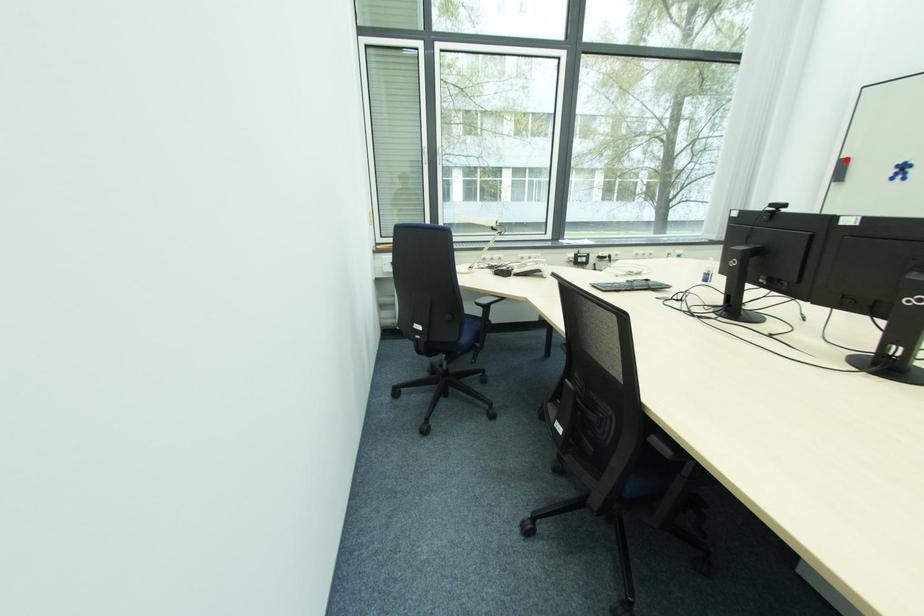
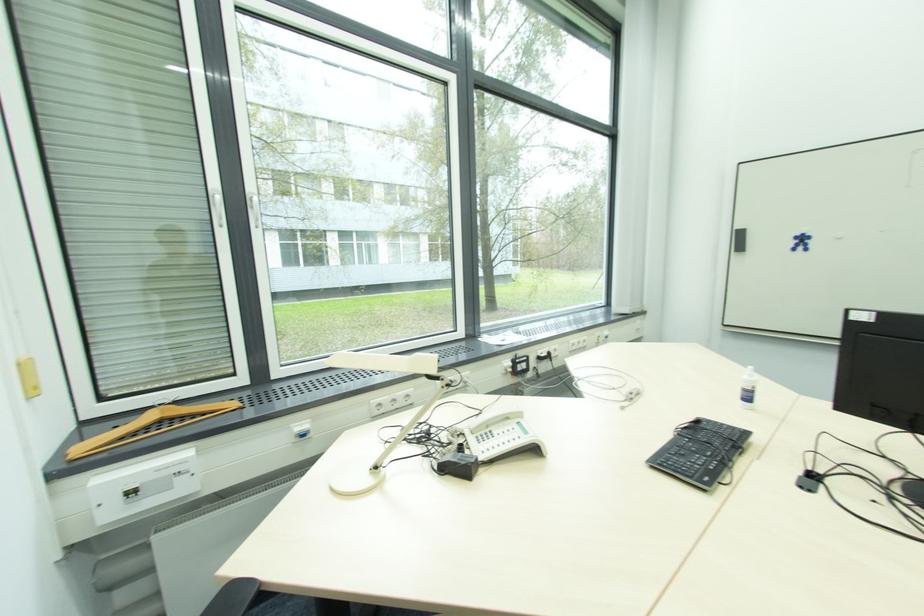
In the second image, find the point that corresponds to the highlighted location in the first image.

(739, 230)